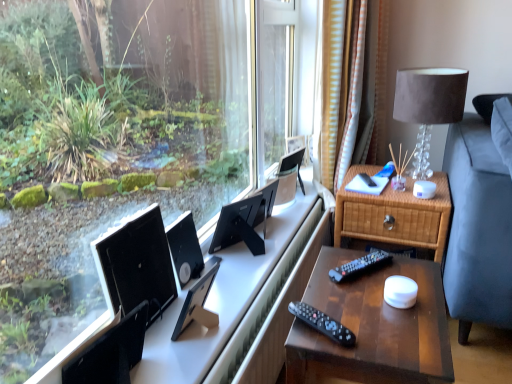
Locate an element on the screen. free space between black matte computer monitor at center, which is counted as the third computer monitor, starting from the front, and black matte computer monitor at center, positioned as the 4th computer monitor in front-to-back order is located at coordinates (214, 272).